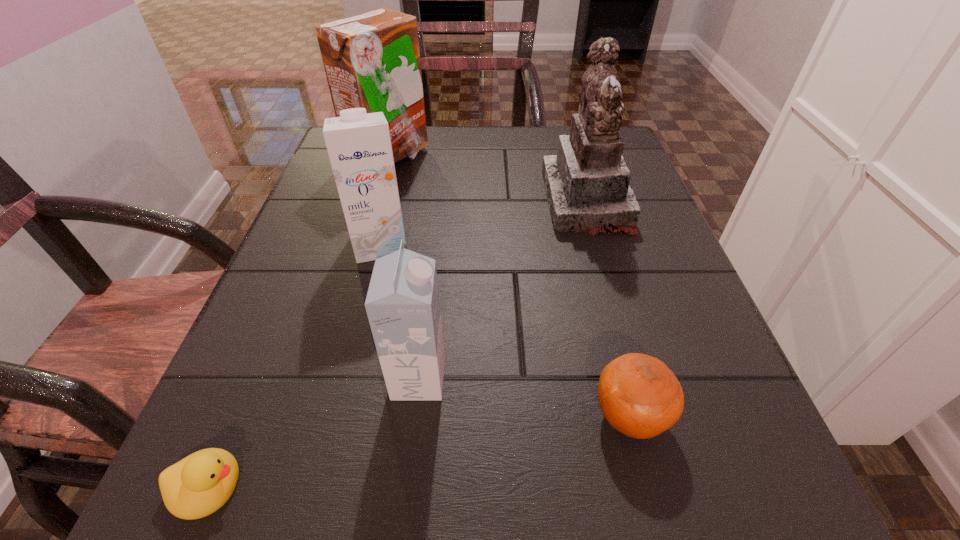
I want to click on figurine positioned at the right edge, so click(587, 186).

Identify the location of orange present at the right edge. The image size is (960, 540). (639, 395).

Where is `object located at the far left corner`? object located at the far left corner is located at coordinates (372, 60).

Locate an element on the screen. This screenshot has width=960, height=540. object that is at the near left corner is located at coordinates (198, 485).

Identify the location of object at the far right corner. (587, 186).

Locate an element on the screen. The image size is (960, 540). free space at the far edge is located at coordinates (543, 137).

In the image, there is a desktop. Where is `free space at the near edge`? This screenshot has height=540, width=960. free space at the near edge is located at coordinates (415, 499).

In the image, there is a desktop. In order to click on vacant space at the left edge in this screenshot , I will do (x=337, y=323).

Find the location of `vacant space at the right edge of the desktop`. vacant space at the right edge of the desktop is located at coordinates (659, 256).

The image size is (960, 540). What are the coordinates of `vacant point located between the duckling and the farthest carton` in the screenshot? It's located at (298, 321).